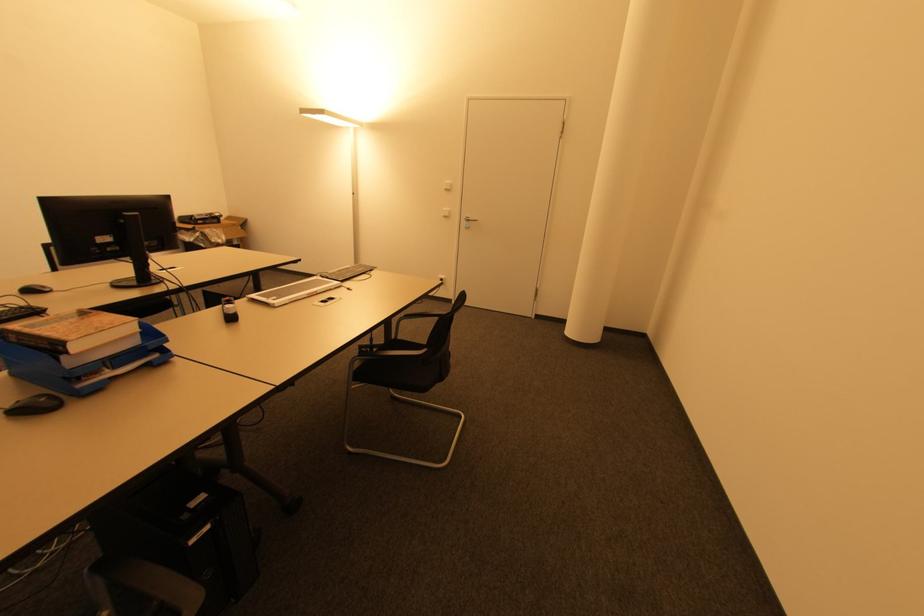
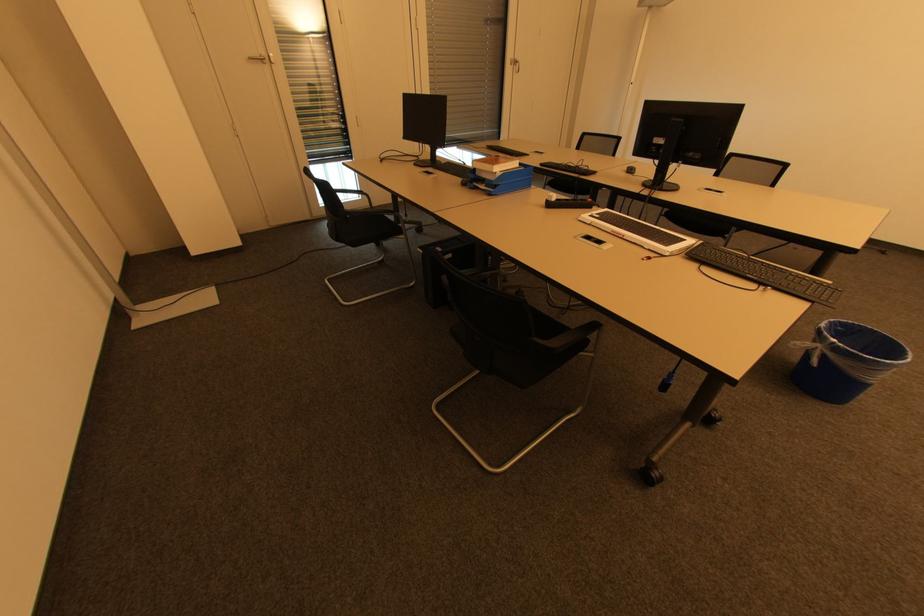
In the second image, find the point that corresponds to point 233,320 in the first image.

(551, 206)